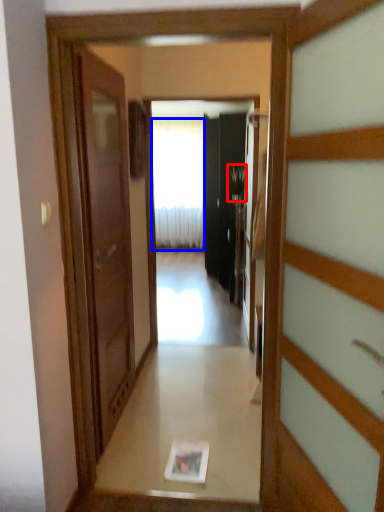
Question: Which object is closer to the camera taking this photo, plant (highlighted by a red box) or curtain (highlighted by a blue box)?

Choices:
 (A) plant
 (B) curtain

Answer: (A)